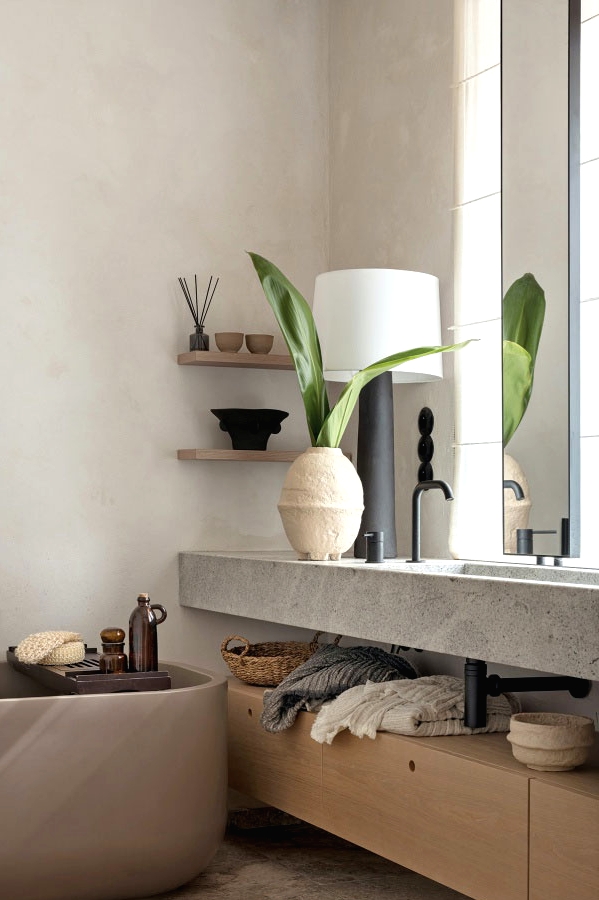
Locate an element on the screen. This screenshot has height=900, width=599. reflection of leaf in mirror is located at coordinates (527, 318).